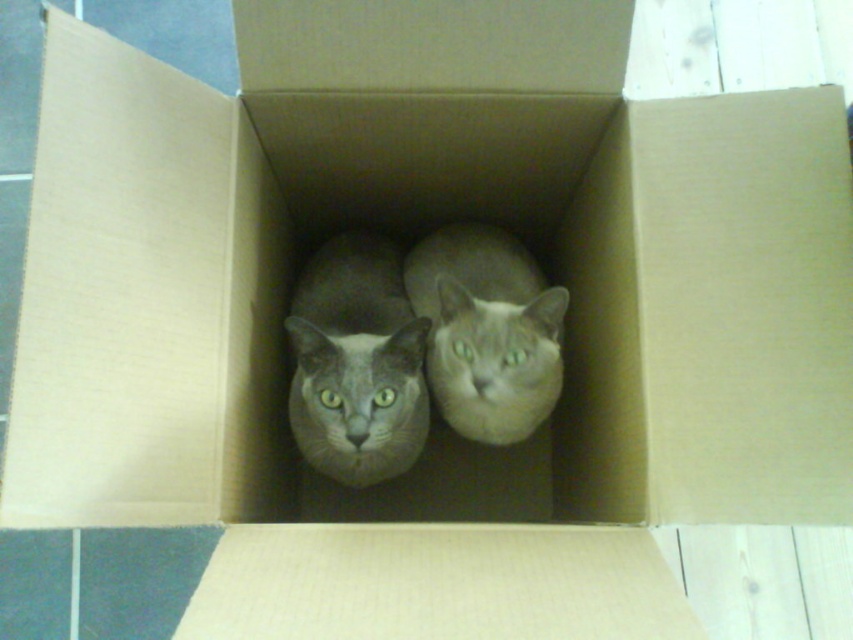
Measure the distance between gray fur cat at center and gray matte cat at center.

A distance of 3.95 inches exists between gray fur cat at center and gray matte cat at center.

Is gray fur cat at center to the right of gray matte cat at center from the viewer's perspective?

Incorrect, gray fur cat at center is not on the right side of gray matte cat at center.

Which is behind, point (326, 461) or point (490, 234)?

The point (490, 234) is more distant.

Where is `gray fur cat at center`? gray fur cat at center is located at coordinates (357, 364).